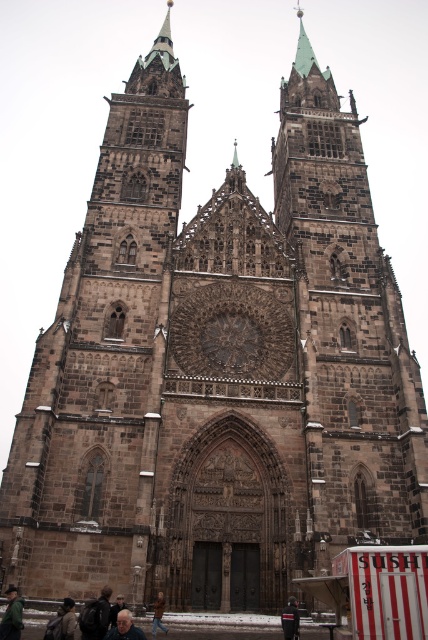
Question: Can you confirm if green woolen jacket at lower left is wider than gray hair at lower center?

Choices:
 (A) no
 (B) yes

Answer: (B)

Question: Which point appears farthest from the camera in this image?

Choices:
 (A) (162, 624)
 (B) (17, 588)
 (C) (116, 614)
 (D) (143, 636)

Answer: (B)

Question: Does green woolen jacket at lower left have a smaller size compared to dark gray jacket at lower center?

Choices:
 (A) no
 (B) yes

Answer: (B)

Question: Which object appears farthest from the camera in this image?

Choices:
 (A) dark gray jacket at lower center
 (B) gray hair at lower center
 (C) dark brown leather jacket at lower center
 (D) brown leather jacket at lower center

Answer: (D)

Question: Does dark gray jacket at lower center appear under dark brown leather jacket at lower center?

Choices:
 (A) no
 (B) yes

Answer: (B)

Question: Which of the following is the farthest from the observer?

Choices:
 (A) brown leather jacket at lower center
 (B) dark brown leather jacket at lower center
 (C) gray hair at lower center

Answer: (A)